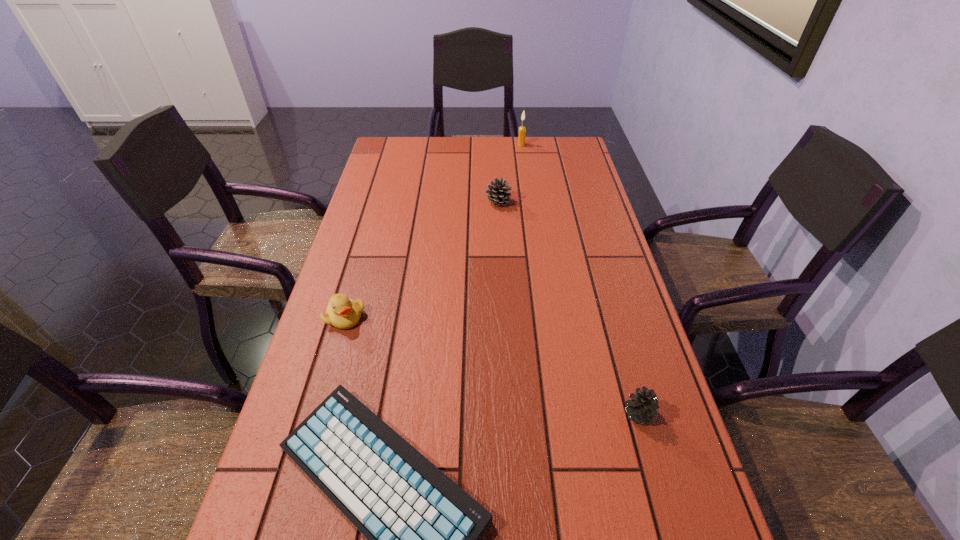
The height and width of the screenshot is (540, 960). In order to click on the tallest object in this screenshot , I will do `click(522, 130)`.

I want to click on the fourth object from left to right, so click(522, 130).

You are a GUI agent. You are given a task and a screenshot of the screen. Output one action in this format:
    pyautogui.click(x=<x>, y=<y>)
    Task: Click on the left pinecone
    This screenshot has width=960, height=540.
    Given the screenshot: What is the action you would take?
    pyautogui.click(x=498, y=193)

At what (x,y) coordinates should I click in order to perform the action: click on the second farthest object. Please return your answer as a coordinate pair (x, y). The width and height of the screenshot is (960, 540). Looking at the image, I should click on (498, 193).

You are a GUI agent. You are given a task and a screenshot of the screen. Output one action in this format:
    pyautogui.click(x=<x>, y=<y>)
    Task: Click on the nearer pinecone
    This screenshot has width=960, height=540.
    Given the screenshot: What is the action you would take?
    pyautogui.click(x=643, y=406)

Where is `the rightmost object`? This screenshot has width=960, height=540. the rightmost object is located at coordinates [643, 406].

You are a GUI agent. You are given a task and a screenshot of the screen. Output one action in this format:
    pyautogui.click(x=<x>, y=<y>)
    Task: Click on the duckling
    
    Given the screenshot: What is the action you would take?
    pyautogui.click(x=342, y=312)

Find the location of a particular element. Image resolution: width=960 pixels, height=540 pixels. blank area located on the front of the candle is located at coordinates (525, 174).

The width and height of the screenshot is (960, 540). I want to click on vacant space located on the left of the farther pinecone, so click(x=366, y=202).

I want to click on blank space located 0.080m on the left of the rightmost object, so click(x=584, y=413).